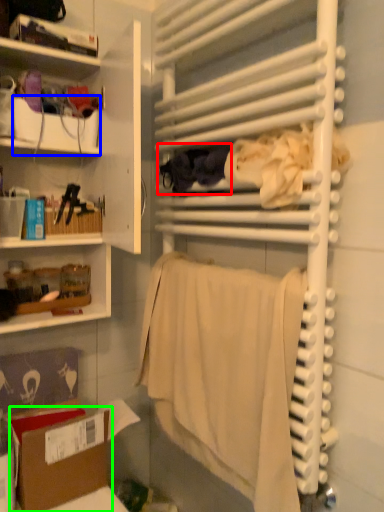
Question: Considering the real-world distances, which object is closest to clothing (highlighted by a red box)? box (highlighted by a blue box) or cardboard box (highlighted by a green box).

Choices:
 (A) box
 (B) cardboard box

Answer: (A)